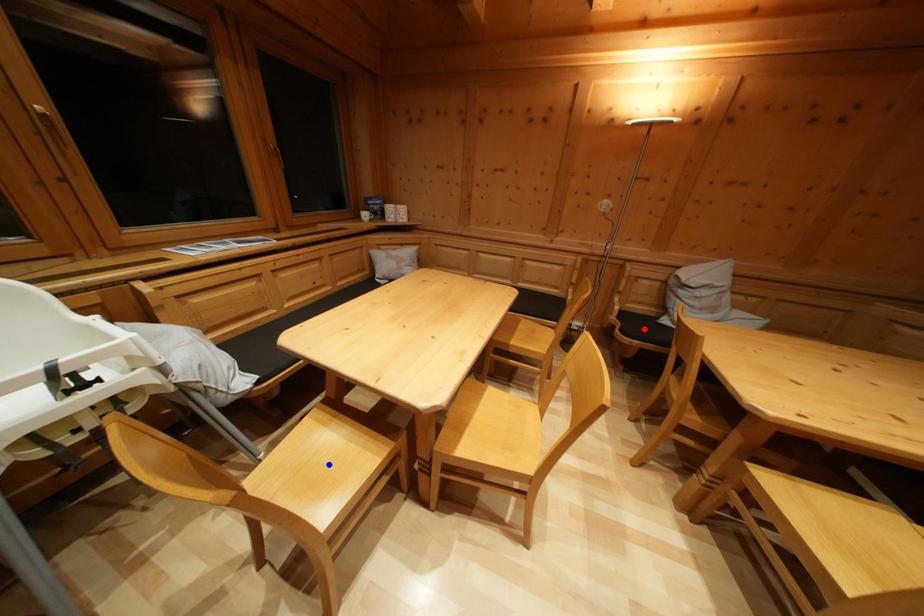
Question: Two points are marked on the image. Which point is closer to the camera?

Choices:
 (A) Blue point is closer.
 (B) Red point is closer.

Answer: (A)